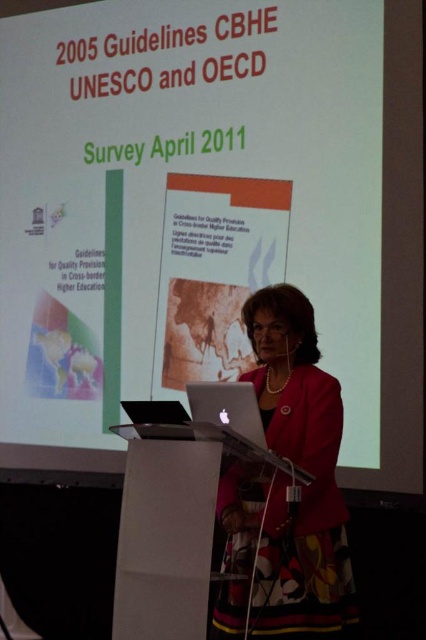
Can you confirm if matte black blazer at center is wider than silver metallic laptop at center?

Yes, matte black blazer at center is wider than silver metallic laptop at center.

Which is more to the right, matte black blazer at center or silver metallic laptop at center?

From the viewer's perspective, matte black blazer at center appears more on the right side.

Is point (322, 410) in front of point (230, 396)?

No, (322, 410) is behind (230, 396).

Find the location of `matte black blazer at center`. matte black blazer at center is located at coordinates (304, 468).